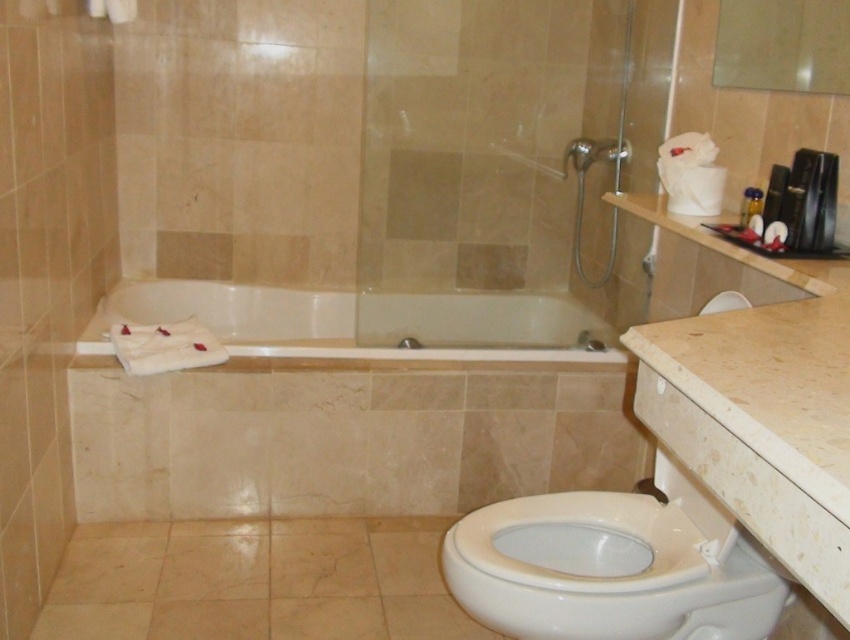
Question: Which point appears closest to the camera in this image?

Choices:
 (A) (507, 305)
 (B) (616, 156)

Answer: (B)

Question: Which object is closer to the camera taking this photo?

Choices:
 (A) white glossy bathtub at center
 (B) white glossy toilet bowl at lower right

Answer: (B)

Question: Which of the following is the farthest from the observer?

Choices:
 (A) white glossy bathtub at center
 (B) matte silver showerhead at upper center
 (C) white glossy toilet bowl at lower right

Answer: (B)

Question: Does white glossy toilet bowl at lower right come behind matte silver showerhead at upper center?

Choices:
 (A) no
 (B) yes

Answer: (A)

Question: Is white glossy toilet bowl at lower right bigger than matte silver showerhead at upper center?

Choices:
 (A) yes
 (B) no

Answer: (A)

Question: Considering the relative positions of white glossy bathtub at center and matte silver showerhead at upper center in the image provided, where is white glossy bathtub at center located with respect to matte silver showerhead at upper center?

Choices:
 (A) above
 (B) below

Answer: (B)